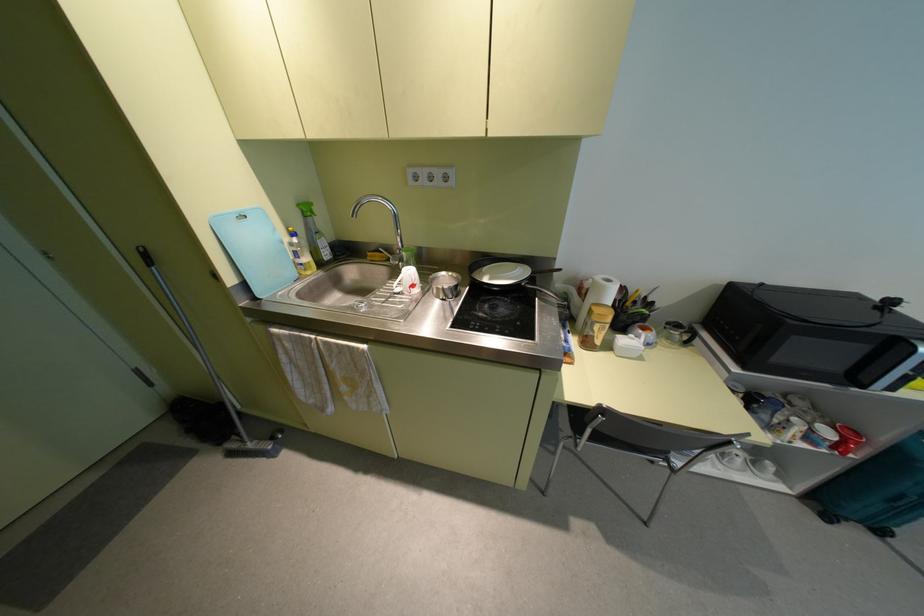
This screenshot has width=924, height=616. I want to click on small pot handle, so click(541, 291).